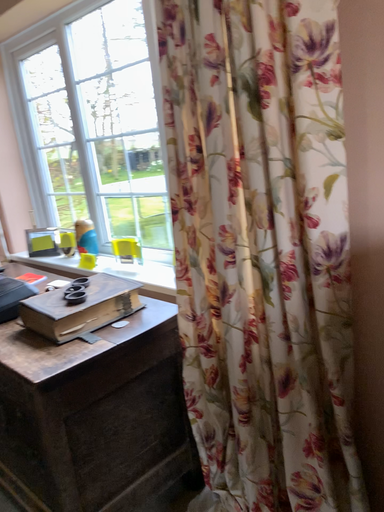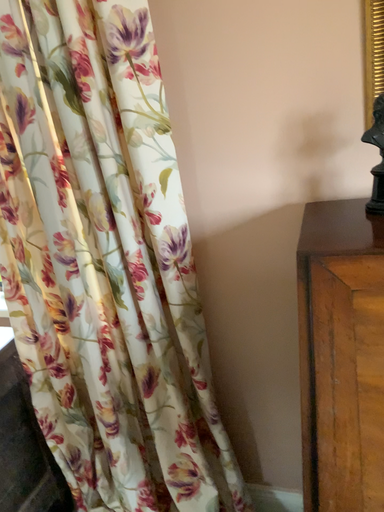
Question: How did the camera likely rotate when shooting the video?

Choices:
 (A) rotated left
 (B) rotated right

Answer: (B)